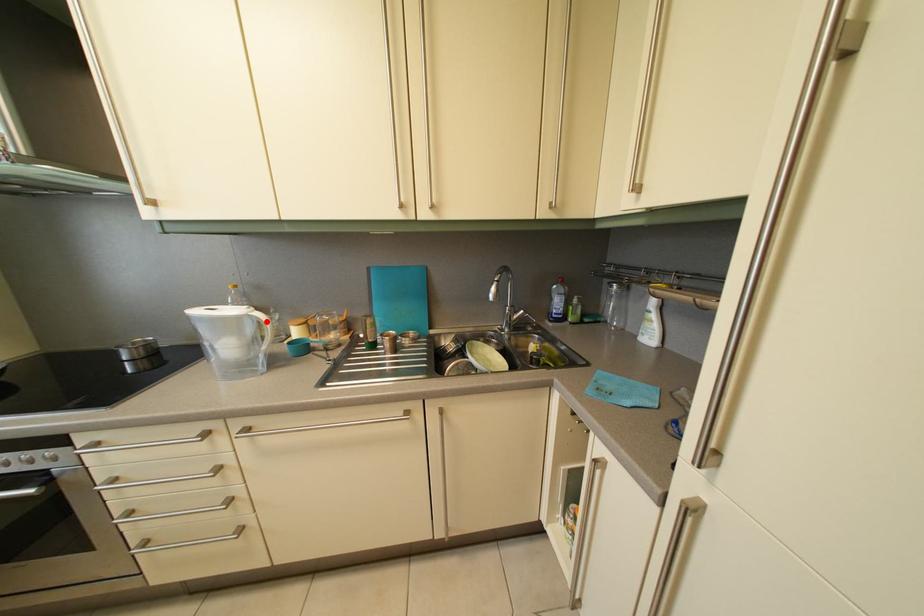
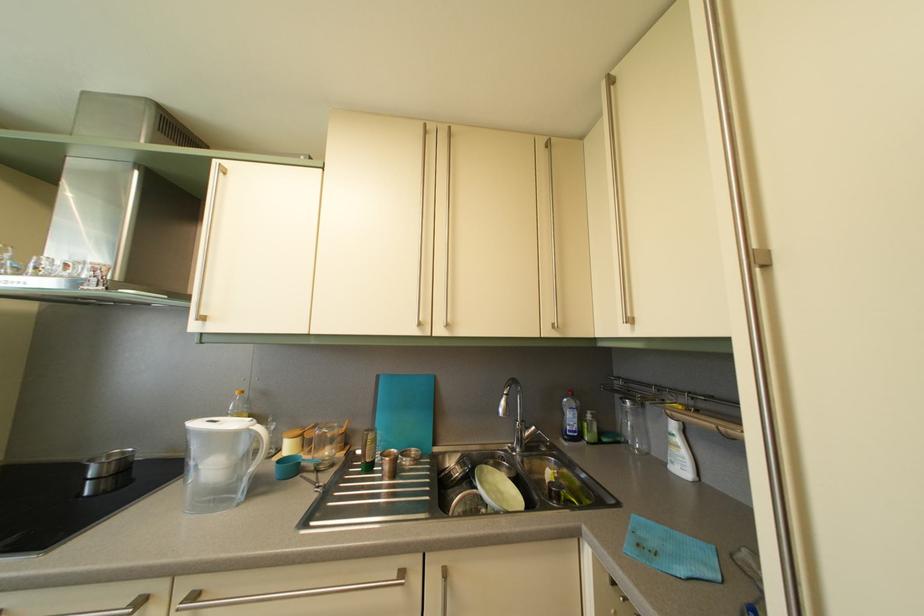
Find the pixel in the second image that matches the highlighted location in the first image.

(266, 436)